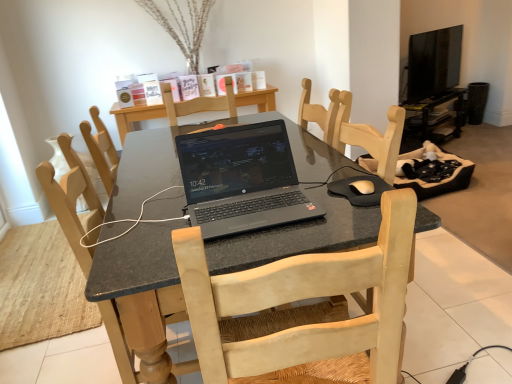
Question: From a real-world perspective, does black rubber mousepad at center sit lower than black glossy tv at upper right?

Choices:
 (A) no
 (B) yes

Answer: (B)

Question: Is there a large distance between black rubber mousepad at center and black glossy tv at upper right?

Choices:
 (A) no
 (B) yes

Answer: (B)

Question: Does black rubber mousepad at center have a larger size compared to black glossy tv at upper right?

Choices:
 (A) no
 (B) yes

Answer: (A)

Question: Can you confirm if black rubber mousepad at center is wider than black glossy tv at upper right?

Choices:
 (A) no
 (B) yes

Answer: (B)

Question: Can you confirm if black rubber mousepad at center is positioned to the left of black glossy tv at upper right?

Choices:
 (A) no
 (B) yes

Answer: (B)

Question: In the image, is light wood chair at center on the left side or the right side of black glossy computer desk at upper right?

Choices:
 (A) right
 (B) left

Answer: (B)

Question: Looking at the image, does light wood chair at center seem bigger or smaller compared to black glossy computer desk at upper right?

Choices:
 (A) small
 (B) big

Answer: (B)

Question: Do you think light wood chair at center is within black glossy computer desk at upper right, or outside of it?

Choices:
 (A) outside
 (B) inside

Answer: (A)

Question: From their relative heights in the image, would you say light wood chair at center is taller or shorter than black glossy computer desk at upper right?

Choices:
 (A) tall
 (B) short

Answer: (A)

Question: From a real-world perspective, is black granite desk at center physically located above or below light wood chair at center?

Choices:
 (A) above
 (B) below

Answer: (B)

Question: In the image, is black granite desk at center on the left side or the right side of light wood chair at center?

Choices:
 (A) left
 (B) right

Answer: (B)

Question: Is point (156, 233) positioned closer to the camera than point (190, 365)?

Choices:
 (A) farther
 (B) closer

Answer: (B)

Question: In terms of size, does black granite desk at center appear bigger or smaller than light wood chair at center?

Choices:
 (A) big
 (B) small

Answer: (A)

Question: Is black granite desk at center bigger or smaller than black rubber mousepad at center?

Choices:
 (A) small
 (B) big

Answer: (B)

Question: From the image's perspective, relative to black rubber mousepad at center, is black granite desk at center above or below?

Choices:
 (A) below
 (B) above

Answer: (A)